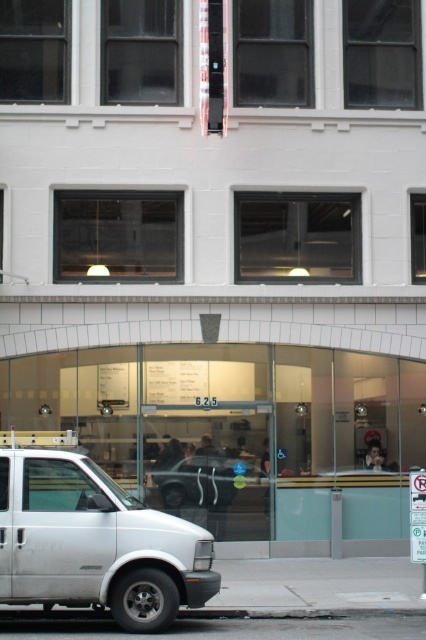
Question: Which point is farther from the camera taking this photo?

Choices:
 (A) (51, 538)
 (B) (195, 477)

Answer: (B)

Question: Does white matte van at lower left lie behind metallic silver car at center?

Choices:
 (A) yes
 (B) no

Answer: (B)

Question: In this image, where is white matte van at lower left located relative to metallic silver car at center?

Choices:
 (A) right
 (B) left

Answer: (B)

Question: Does white matte van at lower left appear under metallic silver car at center?

Choices:
 (A) yes
 (B) no

Answer: (B)

Question: Which point is closer to the camera?

Choices:
 (A) white matte van at lower left
 (B) metallic silver car at center

Answer: (A)